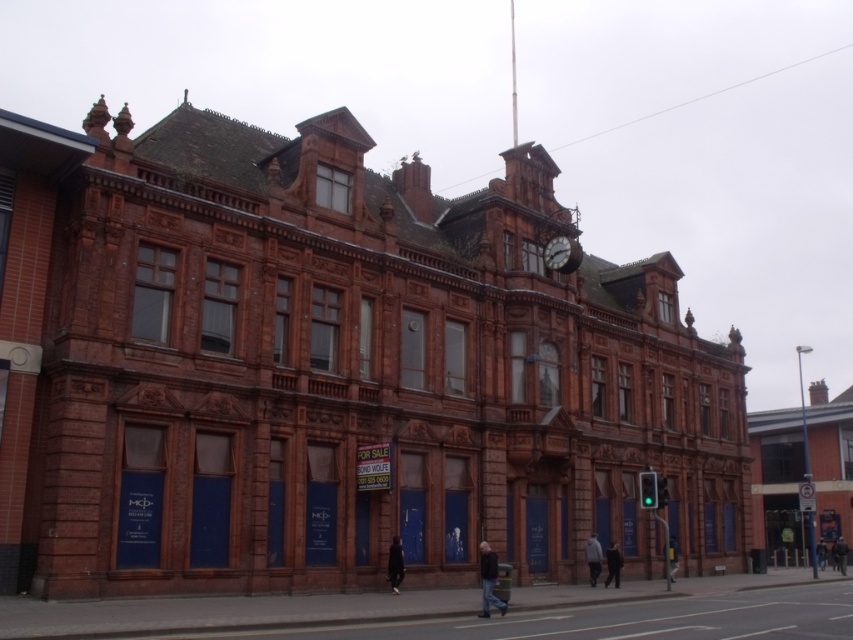
From the picture: You are a delivery person trying to find the entrance to the building. You see a light gray hoodie at center and a dark blue jacket at lower right. Which object is closer to the entrance indicated by the closed blue doors?

The light gray hoodie at center is closer to the entrance indicated by the closed blue doors since it is positioned to the left of the dark blue jacket at lower right, which is further away from the entrance.

You are a delivery person trying to hand over a package to the owner of the building. You see the light gray hoodie at center and dark blue jacket at center hanging on a hook inside the entrance. Which one is higher up?

The light gray hoodie at center is above the dark blue jacket at center, so the light gray hoodie at center is higher up.

You are standing in front of a historic building and want to reach a specific point marked at coordinates point (x=547, y=256). If you can walk 1.5 meters per second, how long will it take you to reach that point?

The distance between point (x=547, y=256) and the viewer is 68.08 meters. At a walking speed of 1.5 meters per second, it would take approximately 45.39 seconds to reach the point.